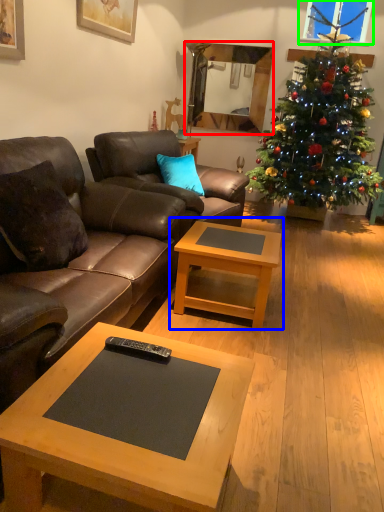
Question: Considering the real-world distances, which object is closest to mirror (highlighted by a red box)? coffee table (highlighted by a blue box) or window screen (highlighted by a green box).

Choices:
 (A) coffee table
 (B) window screen

Answer: (B)